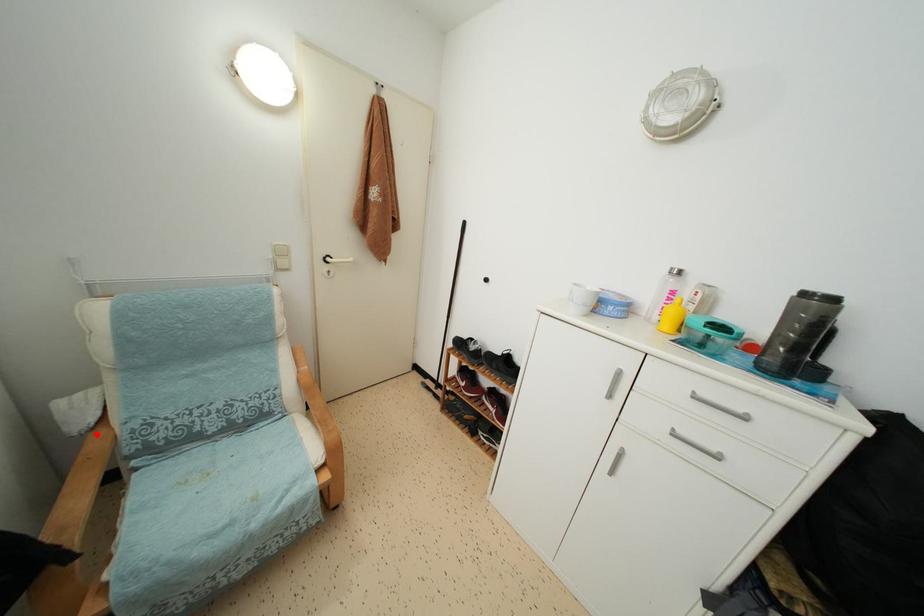
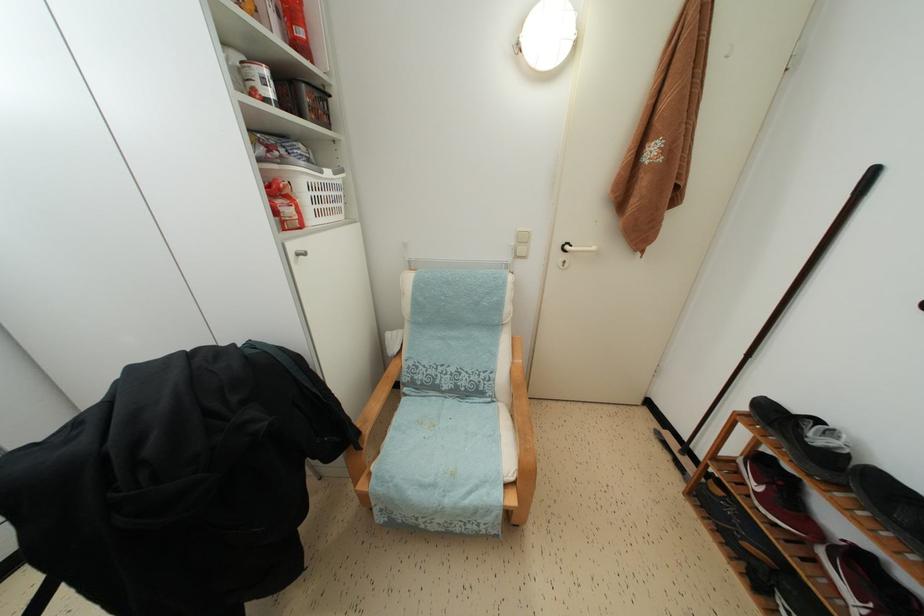
Find the pixel in the second image that matches the highlighted location in the first image.

(399, 362)